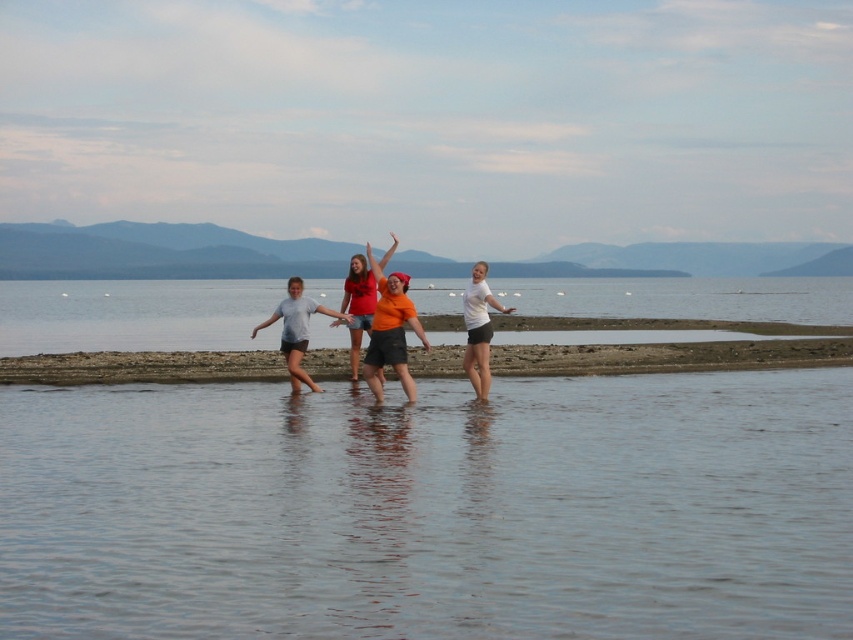
Is point (635, 461) closer to camera compared to point (416, 333)?

Yes, it is in front of point (416, 333).

How distant is clear water at lower center from orange matte shirt at center?

clear water at lower center is 4.04 meters away from orange matte shirt at center.

Find the location of a particular element. This screenshot has height=640, width=853. clear water at lower center is located at coordinates (431, 509).

Is orange matte shirt at center to the right of matte gray shorts at center from the viewer's perspective?

Correct, you'll find orange matte shirt at center to the right of matte gray shorts at center.

In the scene shown: Does orange matte shirt at center come in front of matte gray shorts at center?

Yes.

Does point (376, 369) lie behind point (289, 339)?

No, it is not.

I want to click on orange matte shirt at center, so click(390, 332).

Is clear water at lower center below white matte t-shirt at center?

Indeed, clear water at lower center is positioned under white matte t-shirt at center.

Does clear water at lower center appear on the left side of white matte t-shirt at center?

Correct, you'll find clear water at lower center to the left of white matte t-shirt at center.

Does point (245, 477) come closer to viewer compared to point (476, 292)?

Yes, point (245, 477) is closer to viewer.

Locate an element on the screen. clear water at lower center is located at coordinates (431, 509).